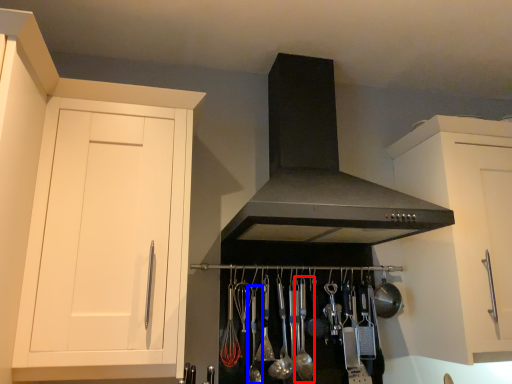
Question: Which object is closer to the camera taking this photo, utensil (highlighted by a red box) or utensil (highlighted by a blue box)?

Choices:
 (A) utensil
 (B) utensil

Answer: (B)